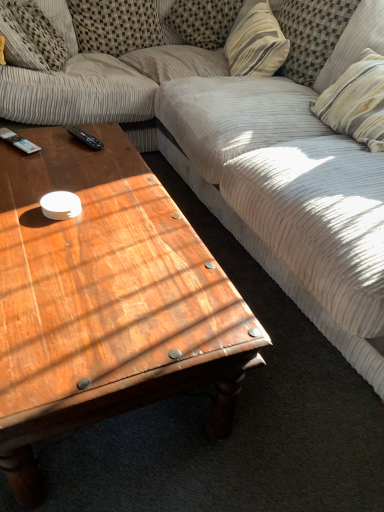
The width and height of the screenshot is (384, 512). I want to click on free point in front of black plastic remote at center, which is the 2th remote control in left-to-right order, so click(80, 163).